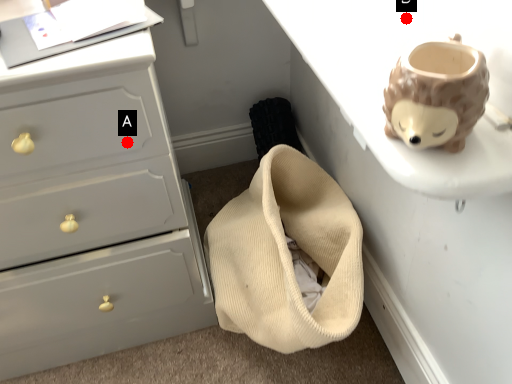
Question: Two points are circled on the image, labeled by A and B beside each circle. Which point is closer to the camera taking this photo?

Choices:
 (A) A is closer
 (B) B is closer

Answer: (B)